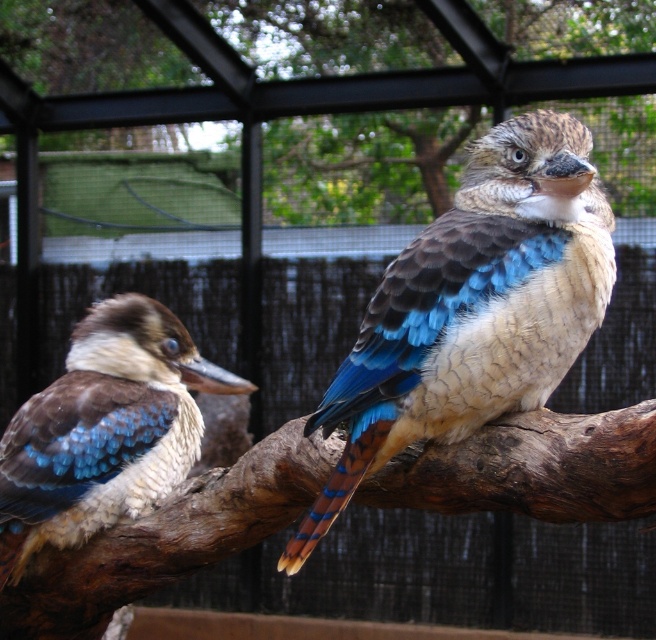
From the picture: You are a bird enthusiast observing two kookaburras in their enclosure. You notice a brown wood branch at upper center. Can you confirm if the branch is located at the coordinates point (350, 90)?

Yes, the brown wood branch at upper center is located at point (350, 90).

You are a visitor at the zoo and want to take a photo of the matte brown and blue bird at center. Since the brown rough wood at center is in the way, will you need to move closer or farther away to get the bird in focus without the wood blocking it?

The brown rough wood at center is closer to the viewer than the matte brown and blue bird at center. To get the bird in focus without the wood blocking it, you would need to move farther away so that the wood becomes smaller in the frame, allowing the bird to be visible behind it.

Looking at this image, you are a zookeeper who needs to place a small feeding tray between the brown rough wood at center and the matte brown and blue bird at center. The tray requires at least 10 inches of space to fit. Can you fit the feeding tray between them?

The brown rough wood at center and the matte brown and blue bird at center are 12.65 inches apart, which is more than the required 10 inches. Therefore, the feeding tray can be placed between them.